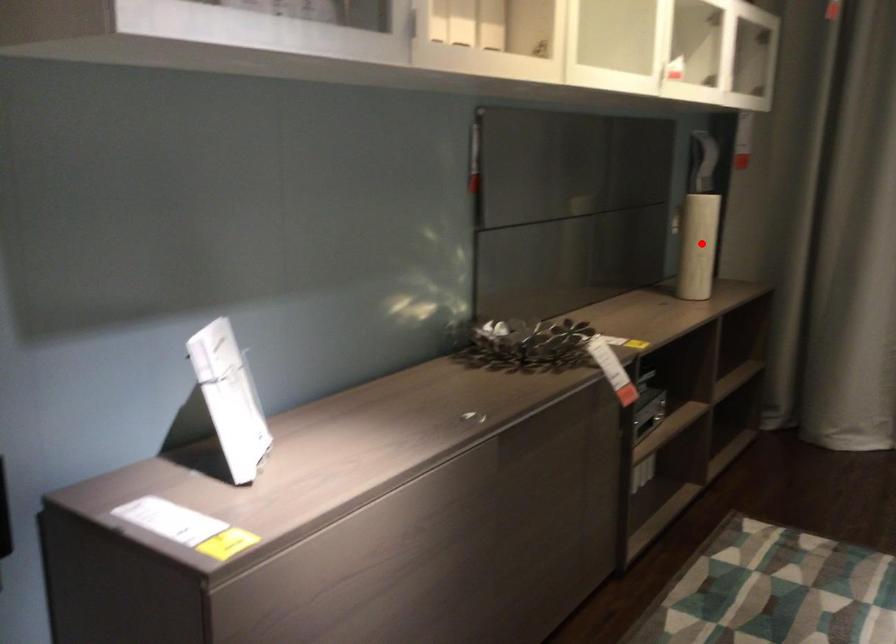
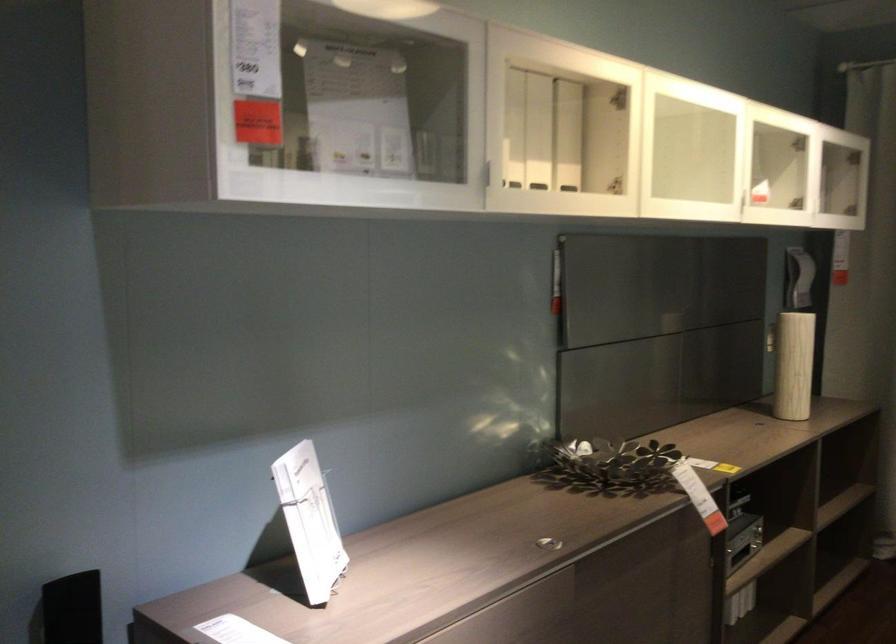
Locate, in the second image, the point that corresponds to the highlighted location in the first image.

(794, 365)